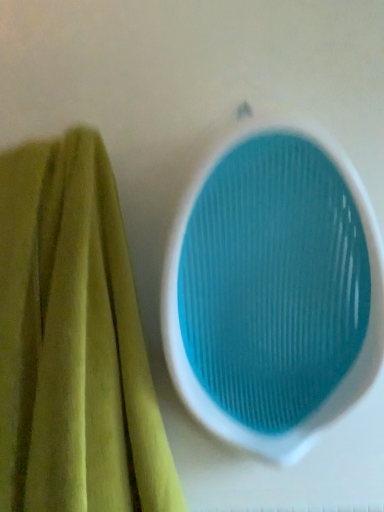
What is the approximate width of blue textured bowl at center?

The width of blue textured bowl at center is 8.00 inches.

You are a GUI agent. You are given a task and a screenshot of the screen. Output one action in this format:
    pyautogui.click(x=<x>, y=<y>)
    Task: Click on the blue textured bowl at center
    This screenshot has height=512, width=384.
    Given the screenshot: What is the action you would take?
    pyautogui.click(x=272, y=287)

What do you see at coordinates (272, 287) in the screenshot?
I see `blue textured bowl at center` at bounding box center [272, 287].

What are the coordinates of `green velvety towel at left` in the screenshot? It's located at (73, 341).

Measure the distance between point (x=43, y=408) and camera.

22.83 inches.

What do you see at coordinates (73, 341) in the screenshot?
I see `green velvety towel at left` at bounding box center [73, 341].

Find the location of `blue textured bowl at center`. blue textured bowl at center is located at coordinates (272, 287).

From the picture: Is blue textured bowl at center at the left side of green velvety towel at left?

No.

Relative to green velvety towel at left, is blue textured bowl at center in front or behind?

In the image, blue textured bowl at center appears behind green velvety towel at left.

Consider the image. Which point is more distant from viewer, (351, 379) or (36, 492)?

The point (351, 379) is farther.

From the image's perspective, is blue textured bowl at center on green velvety towel at left?

Yes, from the image's perspective, blue textured bowl at center is above green velvety towel at left.

From a real-world perspective, is blue textured bowl at center positioned over green velvety towel at left based on gravity?

Indeed, from a real-world perspective, blue textured bowl at center stands above green velvety towel at left.

Which of these two, blue textured bowl at center or green velvety towel at left, is thinner?

With smaller width is blue textured bowl at center.

Who is shorter, blue textured bowl at center or green velvety towel at left?

Standing shorter between the two is blue textured bowl at center.

Between blue textured bowl at center and green velvety towel at left, which one has smaller size?

blue textured bowl at center is smaller.

Is green velvety towel at left inside blue textured bowl at center?

That's incorrect, green velvety towel at left is not inside blue textured bowl at center.

Is blue textured bowl at center not near green velvety towel at left?

No, blue textured bowl at center is not far away from green velvety towel at left.

Is blue textured bowl at center facing towards green velvety towel at left?

No.

The height and width of the screenshot is (512, 384). I want to click on towel on the left of the blue textured bowl at center, so click(73, 341).

Can you confirm if green velvety towel at left is positioned to the left of blue textured bowl at center?

Yes, green velvety towel at left is to the left of blue textured bowl at center.

Is green velvety towel at left closer to the viewer compared to blue textured bowl at center?

Yes, the depth of green velvety towel at left is less than that of blue textured bowl at center.

Is point (74, 505) closer or farther from the camera than point (242, 167)?

Point (74, 505) is positioned farther from the camera compared to point (242, 167).

From the image's perspective, relative to blue textured bowl at center, is green velvety towel at left above or below?

green velvety towel at left is below blue textured bowl at center.

From a real-world perspective, does green velvety towel at left stand above blue textured bowl at center?

No, from a real-world perspective, green velvety towel at left is not on top of blue textured bowl at center.

Considering the relative sizes of green velvety towel at left and blue textured bowl at center in the image provided, is green velvety towel at left thinner than blue textured bowl at center?

No.

Between green velvety towel at left and blue textured bowl at center, which one has more height?

With more height is green velvety towel at left.

Who is bigger, green velvety towel at left or blue textured bowl at center?

green velvety towel at left.

Would you say green velvety towel at left is outside blue textured bowl at center?

Indeed, green velvety towel at left is completely outside blue textured bowl at center.

Are green velvety towel at left and blue textured bowl at center located far from each other?

green velvety towel at left is actually quite close to blue textured bowl at center.

Is blue textured bowl at center at the back of green velvety towel at left?

No, green velvety towel at left's orientation is not away from blue textured bowl at center.

Can you tell me how much green velvety towel at left and blue textured bowl at center differ in facing direction?

They differ by 3.87 degrees in their facing directions.

What are the coordinates of `towel located below the blue textured bowl at center (from the image's perspective)` in the screenshot? It's located at (73, 341).

You are a GUI agent. You are given a task and a screenshot of the screen. Output one action in this format:
    pyautogui.click(x=<x>, y=<y>)
    Task: Click on the oval behind the green velvety towel at left
    This screenshot has height=512, width=384.
    Given the screenshot: What is the action you would take?
    pyautogui.click(x=272, y=287)

This screenshot has width=384, height=512. Find the location of `oval above the green velvety towel at left (from the image's perspective)`. oval above the green velvety towel at left (from the image's perspective) is located at coordinates (272, 287).